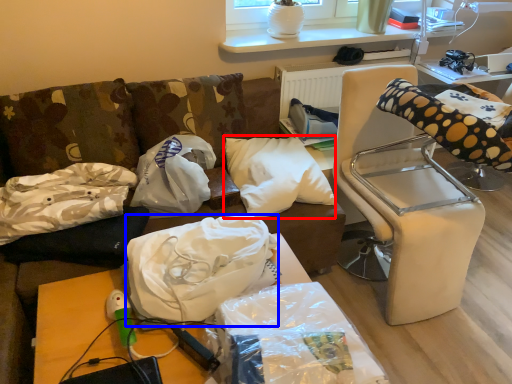
Question: Which object is further to the camera taking this photo, pillow (highlighted by a red box) or material (highlighted by a blue box)?

Choices:
 (A) pillow
 (B) material

Answer: (A)